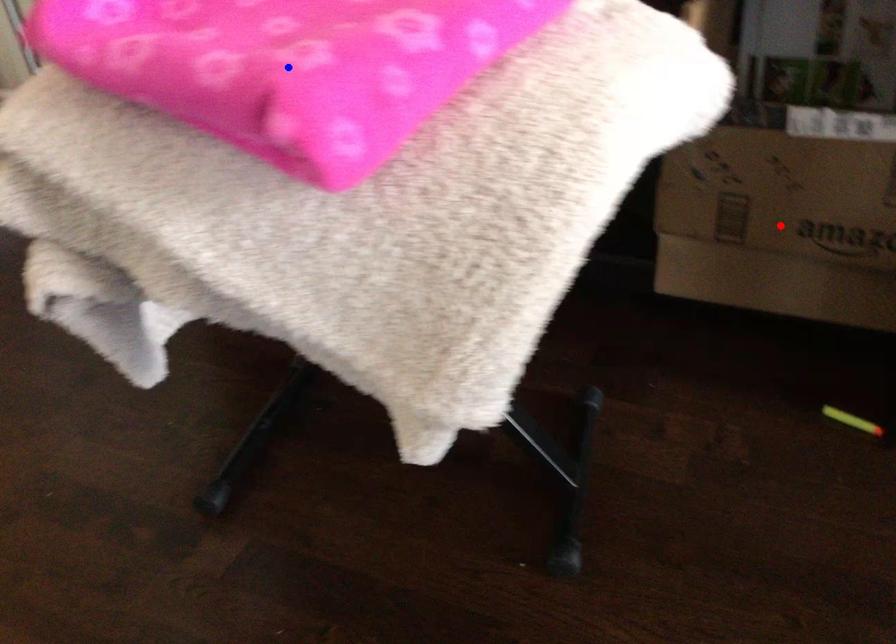
Question: In the image, two points are highlighted. Which point is nearer to the camera? Reply with the corresponding letter.

Choices:
 (A) blue point
 (B) red point

Answer: (A)